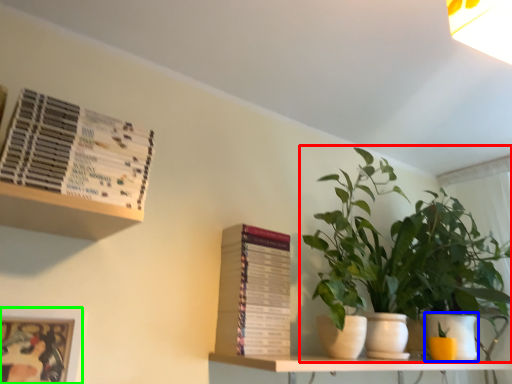
Question: Which object is the farthest from houseplant (highlighted by a red box)? Choose among these: flowerpot (highlighted by a blue box) or picture frame (highlighted by a green box).

Choices:
 (A) flowerpot
 (B) picture frame

Answer: (B)